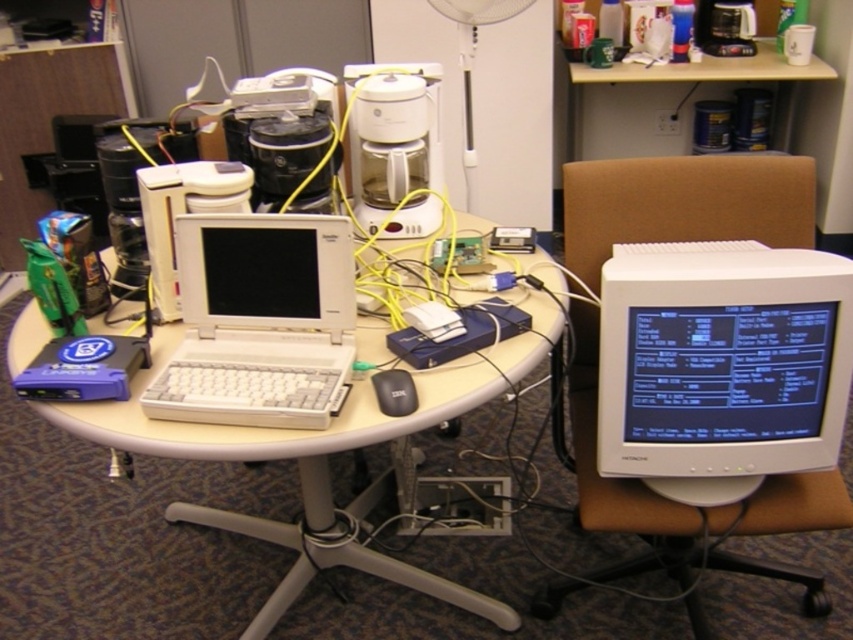
Locate an element on the screen. This screenshot has height=640, width=853. white plastic laptop at center is located at coordinates (259, 321).

Between point (283, 374) and point (380, 390), which one is positioned behind?

Point (283, 374)

Which is in front, point (196, 412) or point (374, 388)?

Point (196, 412) is in front.

In order to click on white plastic laptop at center in this screenshot , I will do `click(259, 321)`.

Does white plastic table at center lie in front of white plastic desktop computer at center?

That is True.

Is white plastic table at center wider than white plastic desktop computer at center?

Yes.

Is point (195, 433) less distant than point (218, 166)?

Yes, it is in front of point (218, 166).

Locate an element on the screen. white plastic table at center is located at coordinates (314, 429).

Is point (770, 204) closer to viewer compared to point (256, 269)?

That is False.

Between point (804, 182) and point (277, 241), which one is positioned behind?

Point (804, 182)

The height and width of the screenshot is (640, 853). Describe the element at coordinates (683, 204) in the screenshot. I see `brown leather swivel chair at right` at that location.

Locate an element on the screen. This screenshot has height=640, width=853. brown leather swivel chair at right is located at coordinates (683, 204).